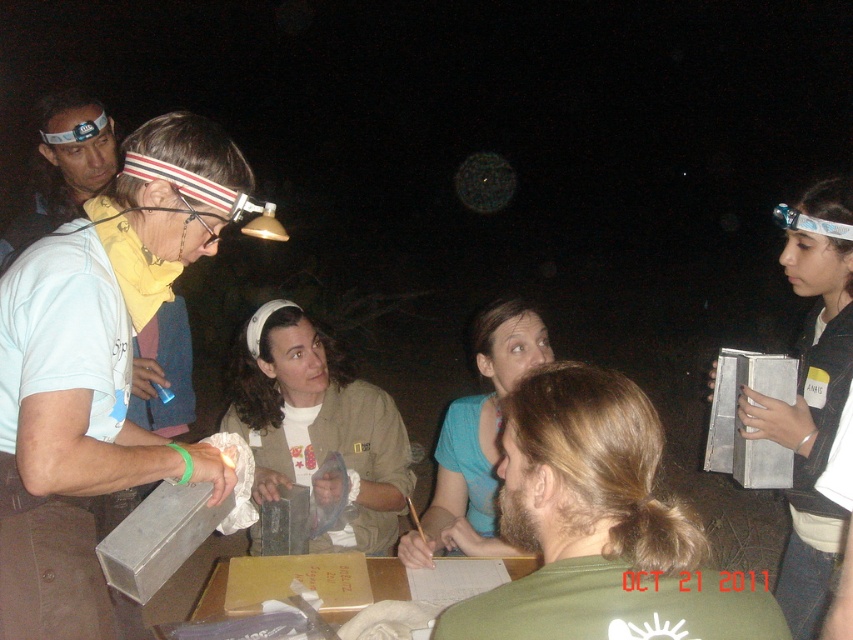
Which is in front, point (6, 460) or point (621, 461)?

Positioned in front is point (621, 461).

What do you see at coordinates (96, 372) in the screenshot?
I see `matte gray box at left` at bounding box center [96, 372].

Between point (131, 225) and point (569, 380), which one is positioned in front?

Point (569, 380)

The height and width of the screenshot is (640, 853). I want to click on matte gray box at left, so click(96, 372).

Is matte gray box at left to the left of matte white shirt at upper left from the viewer's perspective?

In fact, matte gray box at left is to the right of matte white shirt at upper left.

Consider the image. Between matte gray box at left and matte white shirt at upper left, which one is positioned lower?

matte gray box at left is lower down.

Who is more forward, (109, 236) or (141, 339)?

Point (109, 236) is more forward.

The image size is (853, 640). Find the location of `matte gray box at left`. matte gray box at left is located at coordinates (96, 372).

Between khaki fabric jacket at center and matte black headlamp at upper left, which one has less height?

With less height is matte black headlamp at upper left.

Between khaki fabric jacket at center and matte black headlamp at upper left, which one is positioned higher?

matte black headlamp at upper left

The image size is (853, 640). What do you see at coordinates (317, 422) in the screenshot?
I see `khaki fabric jacket at center` at bounding box center [317, 422].

Where is `khaki fabric jacket at center`? khaki fabric jacket at center is located at coordinates pyautogui.click(x=317, y=422).